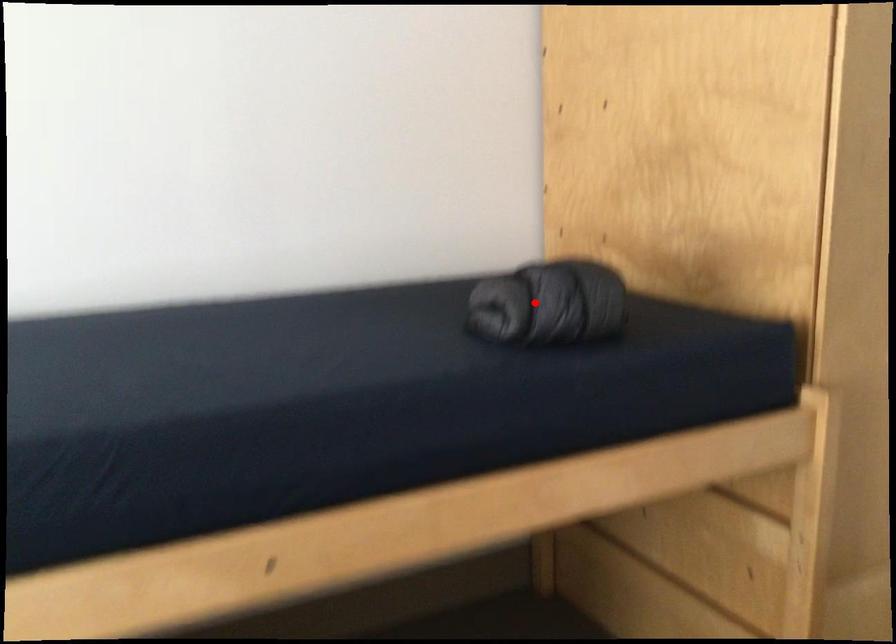
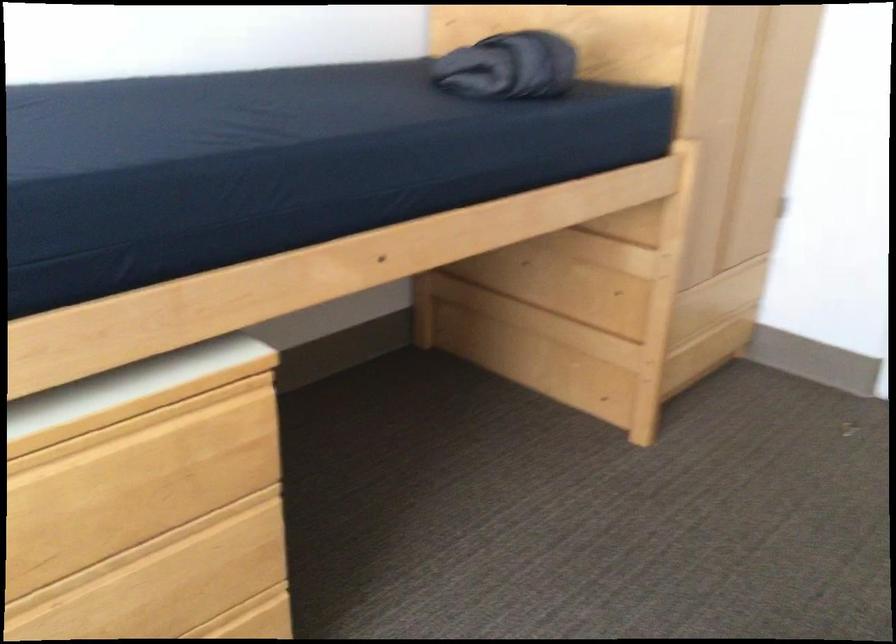
Question: I am providing you with two images of the same scene from different viewpoints. Given a red point in image1, look at the same physical point in image2. Is it:

Choices:
 (A) Closer to the viewpoint
 (B) Farther from the viewpoint

Answer: (B)